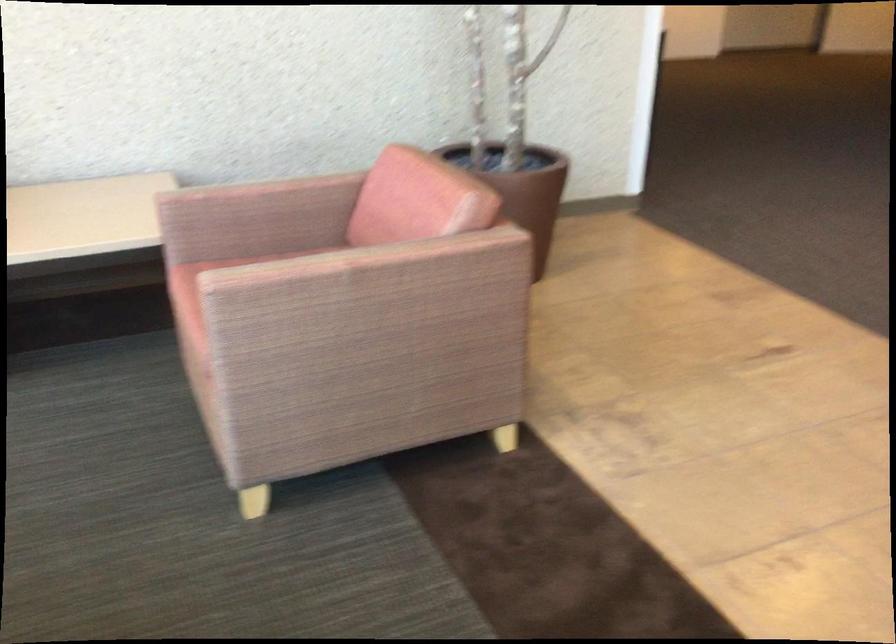
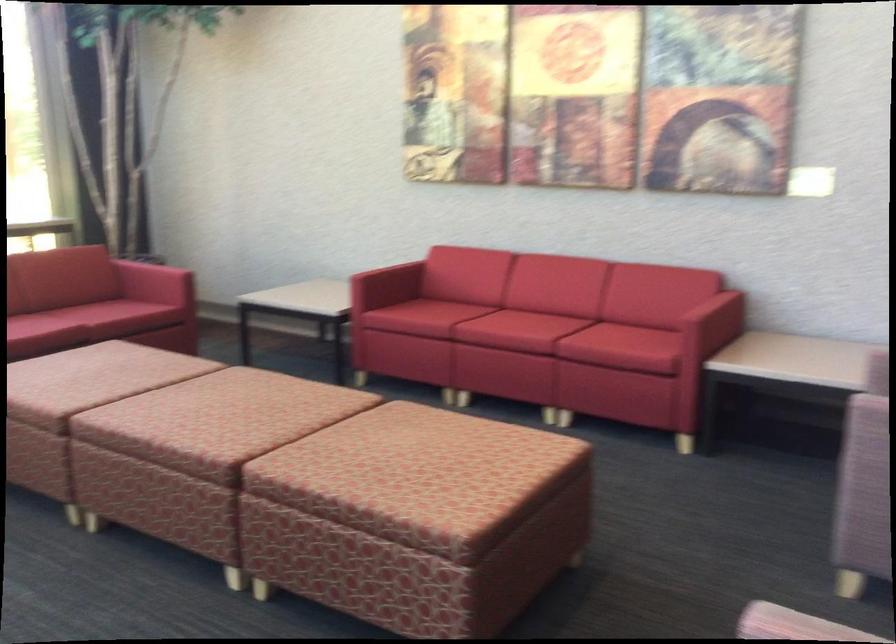
Question: The camera is either moving clockwise (left) or counter-clockwise (right) around the object. The first image is from the beginning of the video and the second image is from the end. Is the camera moving left or right when shooting the video?

Choices:
 (A) Left
 (B) Right

Answer: (B)